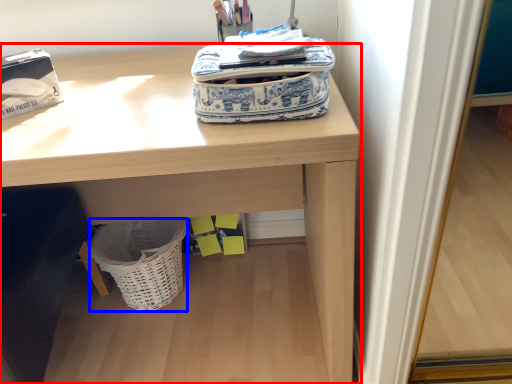
Question: Among these objects, which one is farthest to the camera, desk (highlighted by a red box) or basket (highlighted by a blue box)?

Choices:
 (A) desk
 (B) basket

Answer: (B)